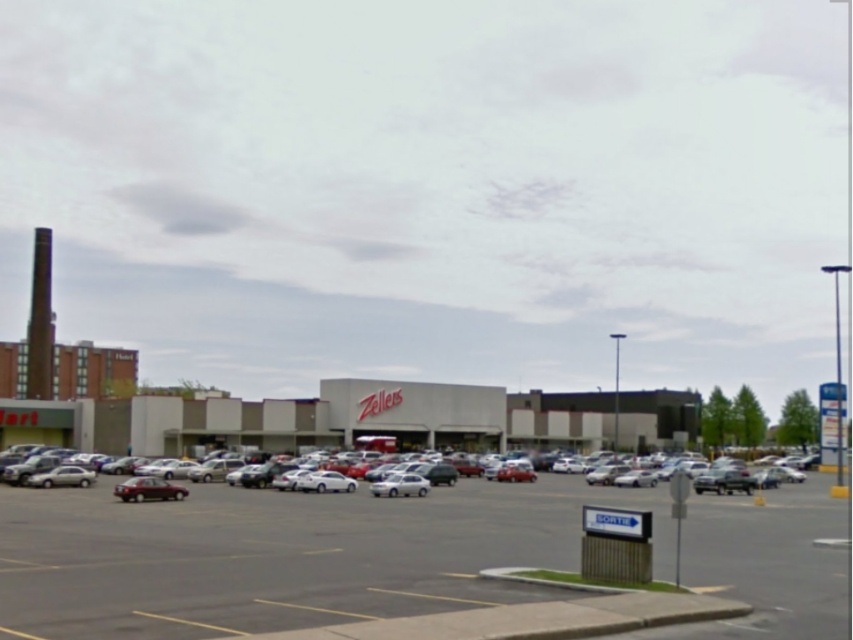
Question: Does metallic maroon sedan at center-left come in front of white glossy sedan at center?

Choices:
 (A) yes
 (B) no

Answer: (A)

Question: Which point is farther from the camera taking this photo?

Choices:
 (A) (158, 470)
 (B) (747, 538)

Answer: (A)

Question: Which point is farther to the camera?

Choices:
 (A) (398, 472)
 (B) (148, 476)

Answer: (B)

Question: In this image, where is metallic silver cars at center located relative to shiny silver sedan at center?

Choices:
 (A) below
 (B) above

Answer: (B)

Question: Does metallic silver cars at center have a greater width compared to white glossy sedan at center?

Choices:
 (A) yes
 (B) no

Answer: (A)

Question: Which point appears farthest from the camera in this image?

Choices:
 (A) (424, 483)
 (B) (161, 492)

Answer: (A)